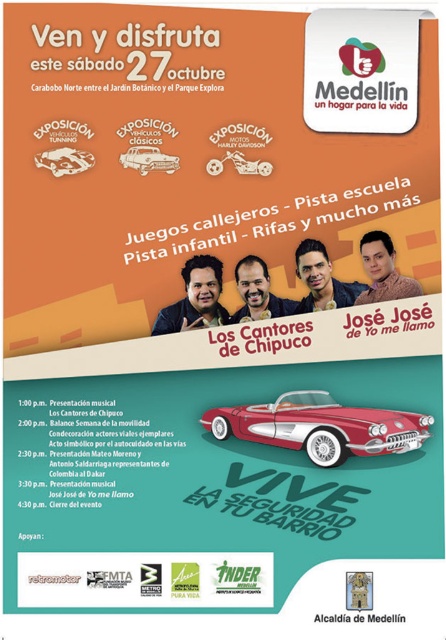
Question: Does shiny red convertible at center appear over shiny chrome car at center?

Choices:
 (A) yes
 (B) no

Answer: (B)

Question: Considering the real-world distances, which object is closest to the shiny red convertible at center?

Choices:
 (A) shiny metallic car at upper left
 (B) shiny chrome car at center

Answer: (B)

Question: Among these points, which one is nearest to the camera?

Choices:
 (A) (271, 440)
 (B) (86, 170)
 (C) (144, 170)

Answer: (B)

Question: Which object is positioned closest to the shiny red convertible at center?

Choices:
 (A) shiny metallic car at upper left
 (B) shiny chrome car at center

Answer: (B)

Question: Does shiny red convertible at center have a lesser width compared to shiny metallic car at upper left?

Choices:
 (A) no
 (B) yes

Answer: (A)

Question: Is shiny red convertible at center thinner than shiny chrome car at center?

Choices:
 (A) yes
 (B) no

Answer: (B)